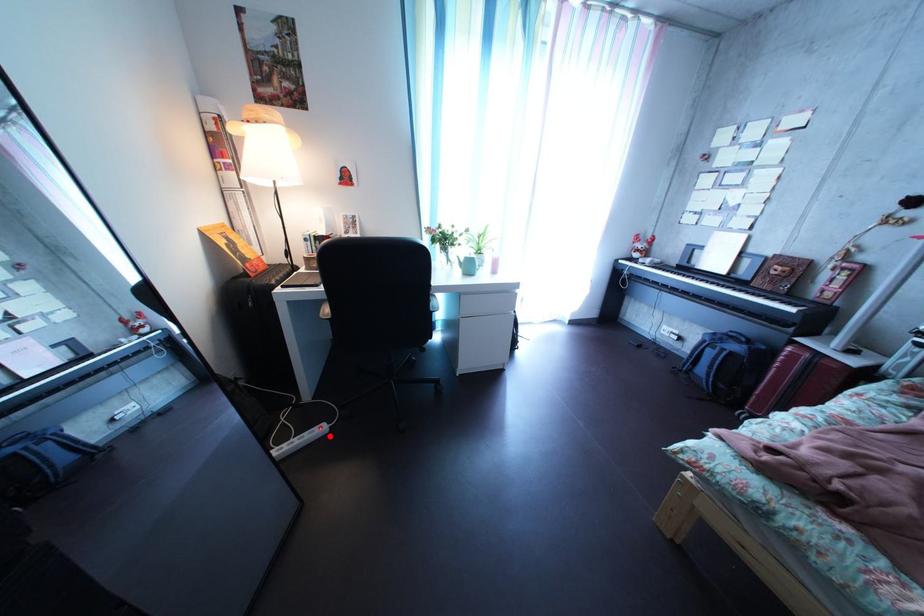
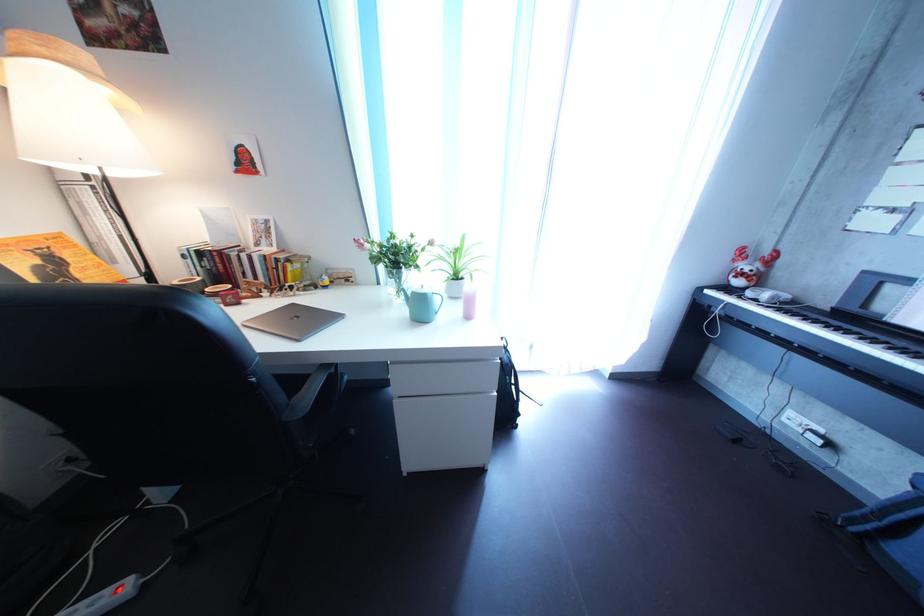
Question: A red point is marked in image1. In image2, is the corresponding 3D point closer to the camera or farther? Reply with the corresponding letter.

Choices:
 (A) The corresponding 3D point is closer.
 (B) The corresponding 3D point is farther.

Answer: (A)